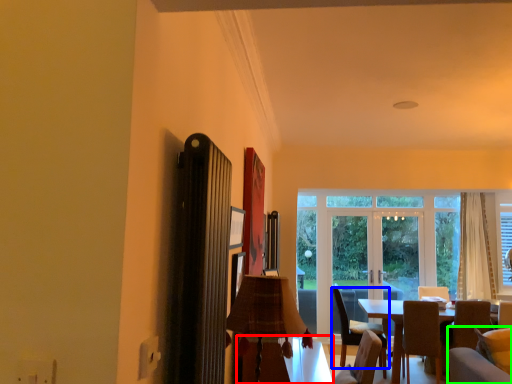
Question: Considering the real-world distances, which object is farthest from table (highlighted by a red box)? chair (highlighted by a blue box) or couch (highlighted by a green box)?

Choices:
 (A) chair
 (B) couch

Answer: (A)